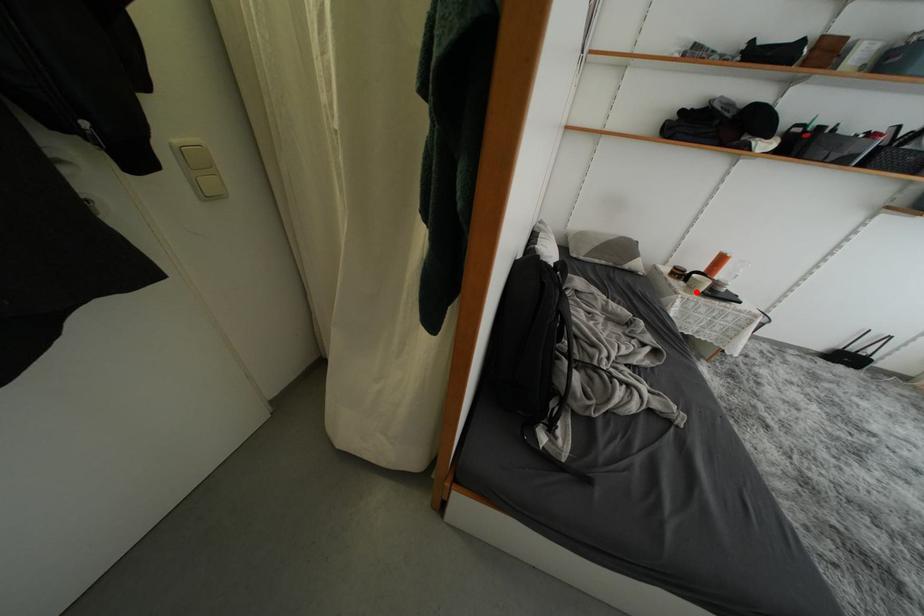
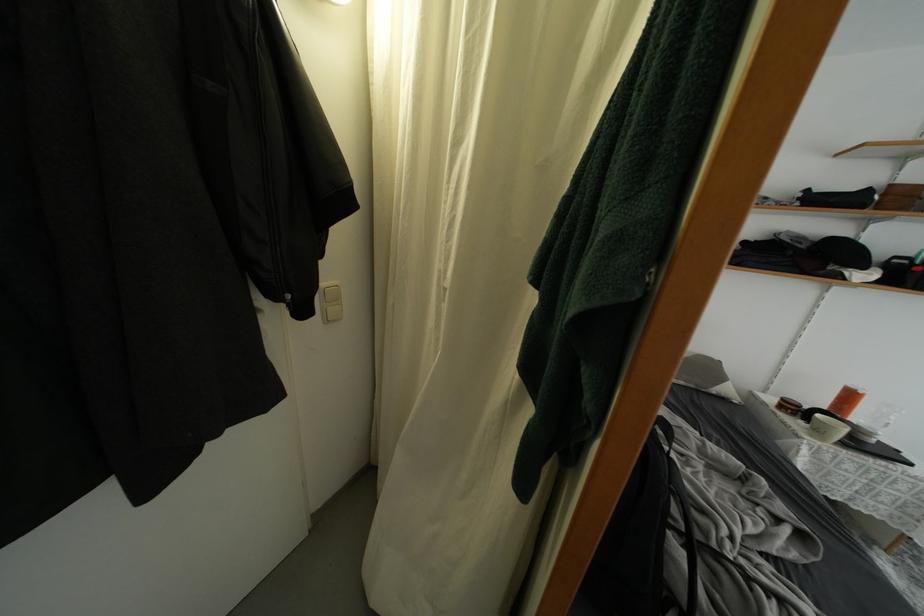
In the second image, find the point that corresponds to the highlighted location in the first image.

(823, 437)